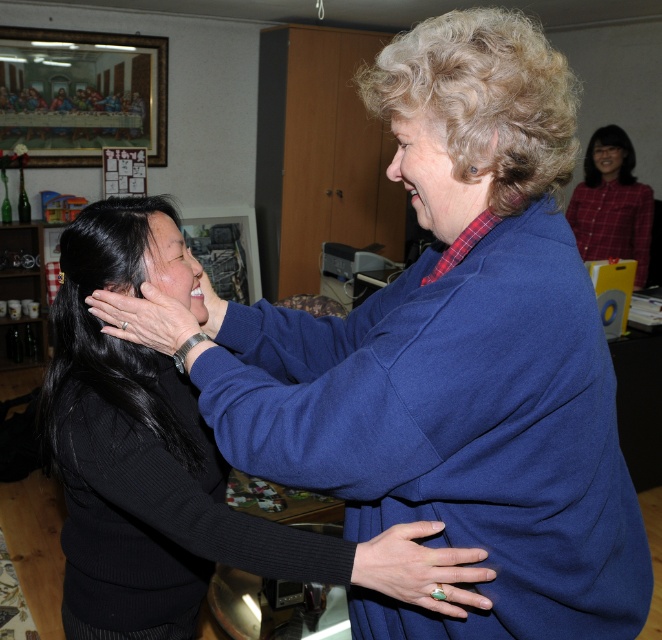
You are an artist sketching this scene and want to ensure the green gemstone ring at center and the matte black hand at upper left are positioned correctly. Based on the scene description, which object should be drawn lower in the image?

The green gemstone ring at center should be drawn lower in the image because it is located below the matte black hand at upper left.

Consider the image. Where is the plaid fabric shirt at upper right located in the image?

The plaid fabric shirt at upper right is located at the 2D coordinates point [610,204].

You are standing in the room and want to reach the point at coordinates [583,244]. If your walking speed is 3 feet per second, how many seconds will it take you to reach that point?

The point at coordinates [583,244] is 13.00 feet away from you. At a walking speed of 3 feet per second, it would take approximately 4.33 seconds to reach that point.